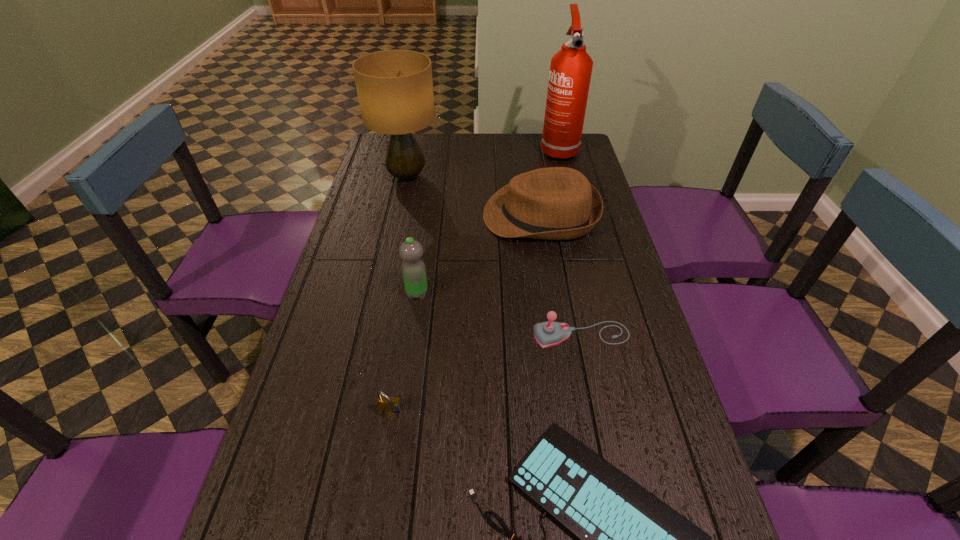
Find the location of a particular element. This screenshot has width=960, height=540. joystick that is at the right edge is located at coordinates point(549,333).

Identify the location of object that is at the far left corner. The image size is (960, 540). (395, 88).

Identify the location of object positioned at the far right corner. 570,73.

Where is `vacant space at the far edge of the desktop`? vacant space at the far edge of the desktop is located at coordinates (488, 154).

In order to click on free space at the left edge of the desktop in this screenshot , I will do `click(373, 276)`.

I want to click on free space at the right edge of the desktop, so click(589, 343).

The image size is (960, 540). Identify the location of vacant region between the fourth farthest object and the fourth tallest object. (479, 255).

This screenshot has height=540, width=960. What are the coordinates of `empty space that is in between the padlock and the tallest object` in the screenshot? It's located at (474, 281).

The height and width of the screenshot is (540, 960). Find the location of `empty space between the fourth farthest object and the sixth farthest object`. empty space between the fourth farthest object and the sixth farthest object is located at coordinates (404, 353).

You are a GUI agent. You are given a task and a screenshot of the screen. Output one action in this format:
    pyautogui.click(x=<x>, y=<y>)
    Task: Click on the vacant region between the second tallest object and the fire extinguisher
    
    Given the screenshot: What is the action you would take?
    pyautogui.click(x=483, y=163)